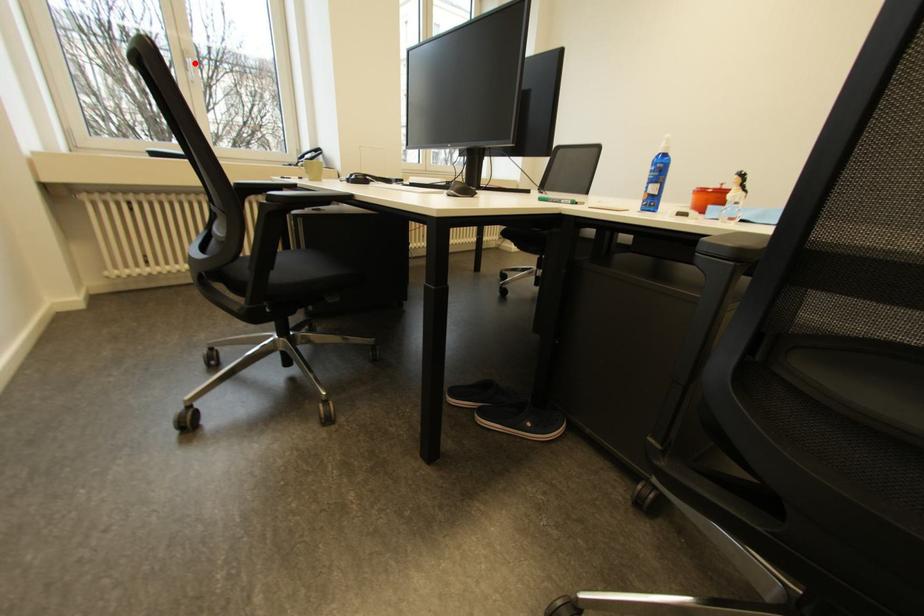
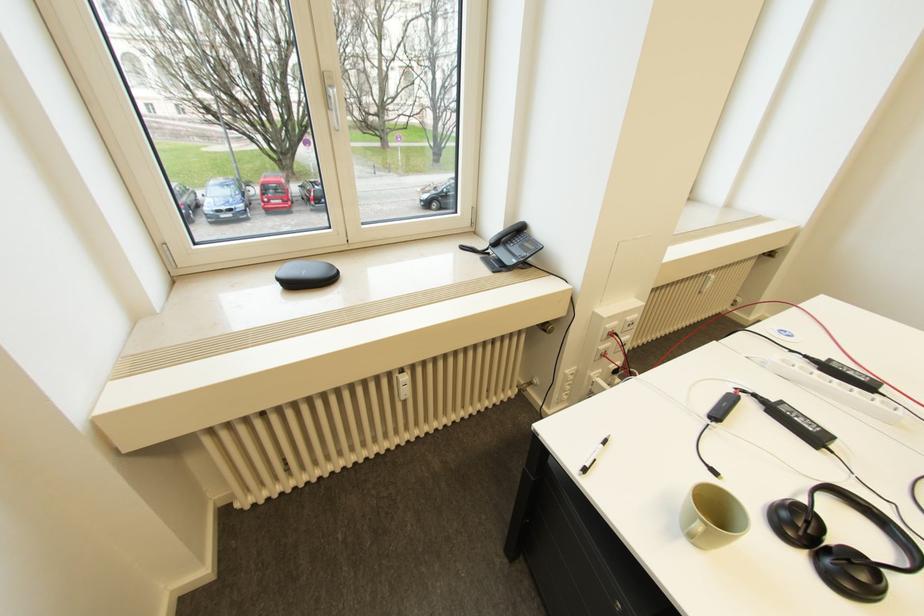
Where in the second image is the point corresponding to the highlighted location from the first image?

(335, 98)